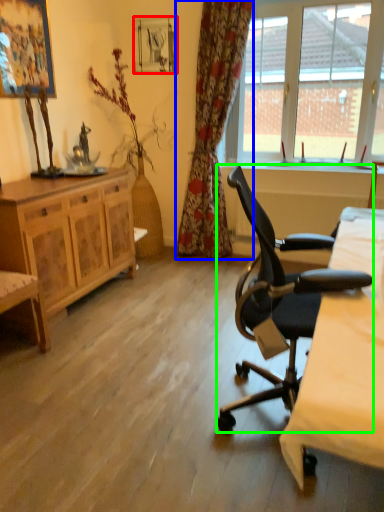
Question: Considering the real-world distances, which object is farthest from picture frame (highlighted by a red box)? curtain (highlighted by a blue box) or chair (highlighted by a green box)?

Choices:
 (A) curtain
 (B) chair

Answer: (B)